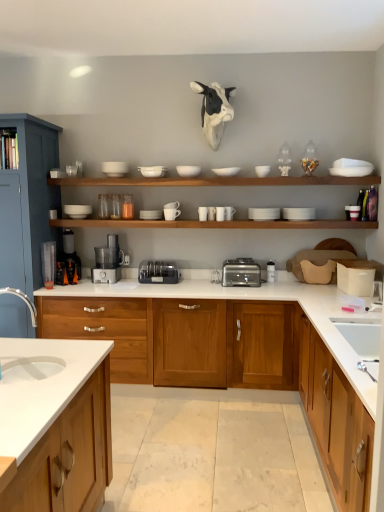
Locate an element on the screen. The height and width of the screenshot is (512, 384). free space in front of white glossy sink at lower left, placed as the 1th sink when sorted from front to back is located at coordinates (16, 377).